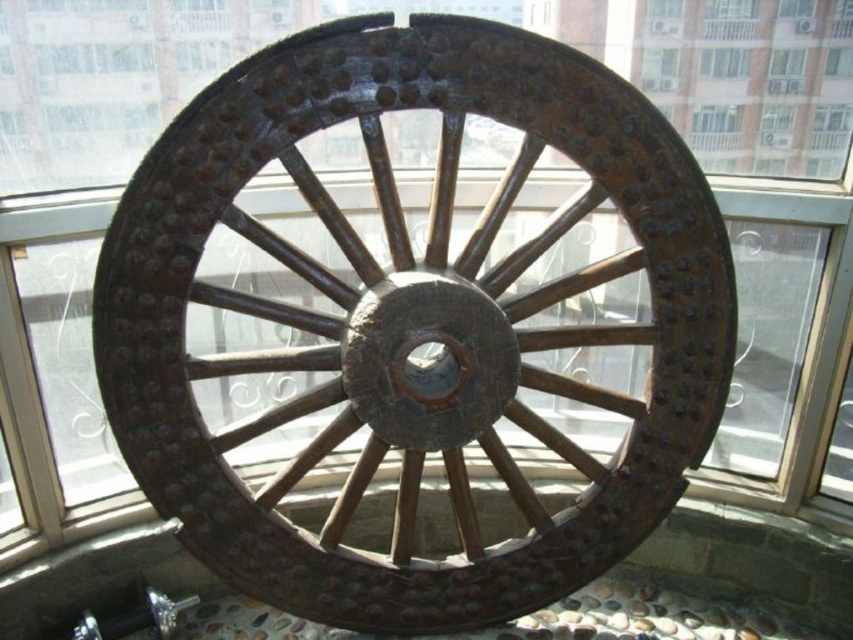
Question: Can you confirm if rusty wood wagon wheel at center is positioned to the left of clear glass window at upper center?

Choices:
 (A) yes
 (B) no

Answer: (A)

Question: Is rusty wood wagon wheel at center thinner than clear glass window at upper center?

Choices:
 (A) yes
 (B) no

Answer: (B)

Question: Can you confirm if rusty wood wagon wheel at center is thinner than clear glass window at upper center?

Choices:
 (A) no
 (B) yes

Answer: (A)

Question: Among these objects, which one is farthest from the camera?

Choices:
 (A) rusty wood wagon wheel at center
 (B) clear glass window at upper center

Answer: (B)

Question: Which object appears closest to the camera in this image?

Choices:
 (A) clear glass window at upper center
 (B) rusty wood wagon wheel at center

Answer: (B)